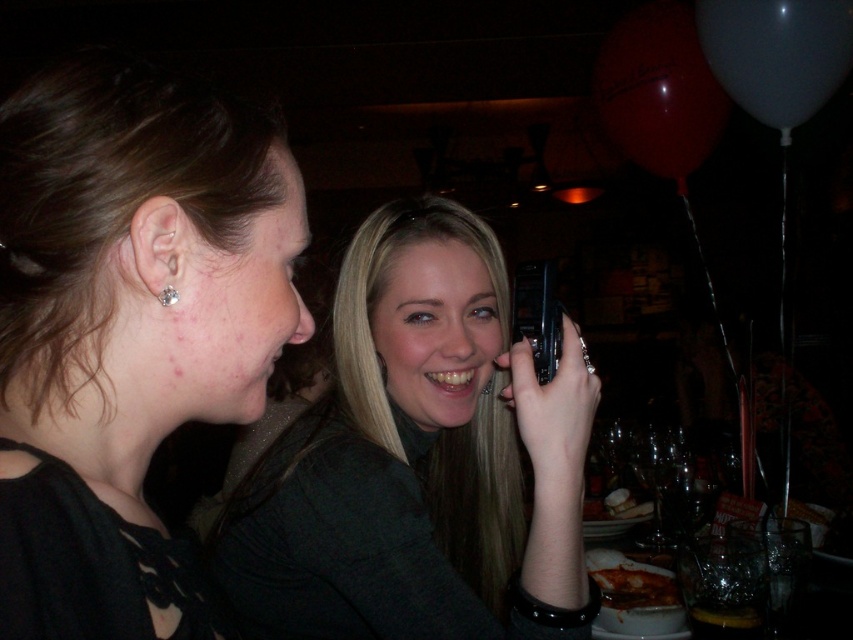
You are a photographer at a party and want to capture both the smooth gray shirt at center and the black plastic phone at center in your shot. Based on their positions, which object should you focus on first to ensure both are in frame?

The smooth gray shirt at center is much taller than the black plastic phone at center, so you should focus on the smooth gray shirt at center first to ensure both are in frame.

You are trying to decide which item to reach for first between the smooth gray shirt at center and the silver metallic earring at ear. If you can only grab one item, which one is easier to grab based on their sizes?

The smooth gray shirt at center has a larger size compared to silver metallic earring at ear, so it is easier to grab.